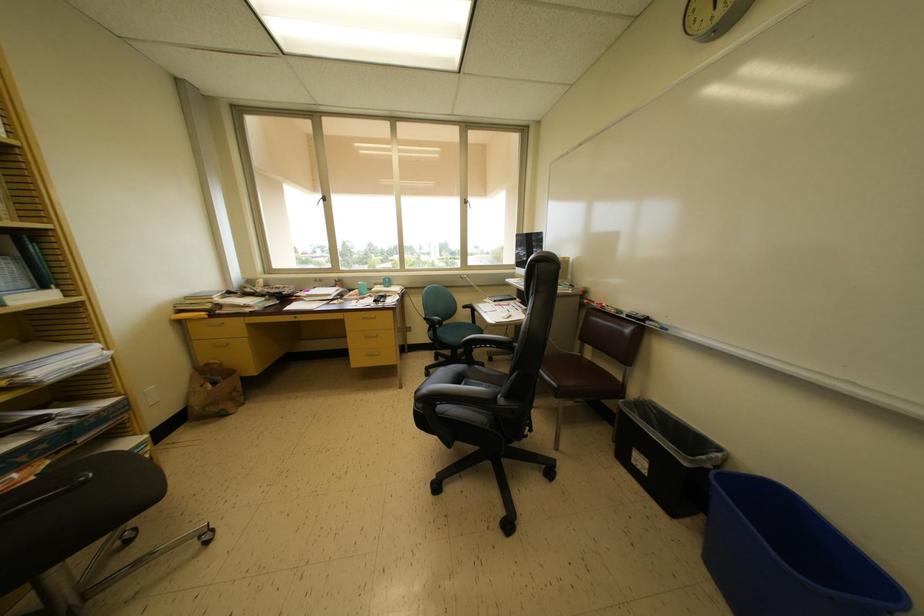
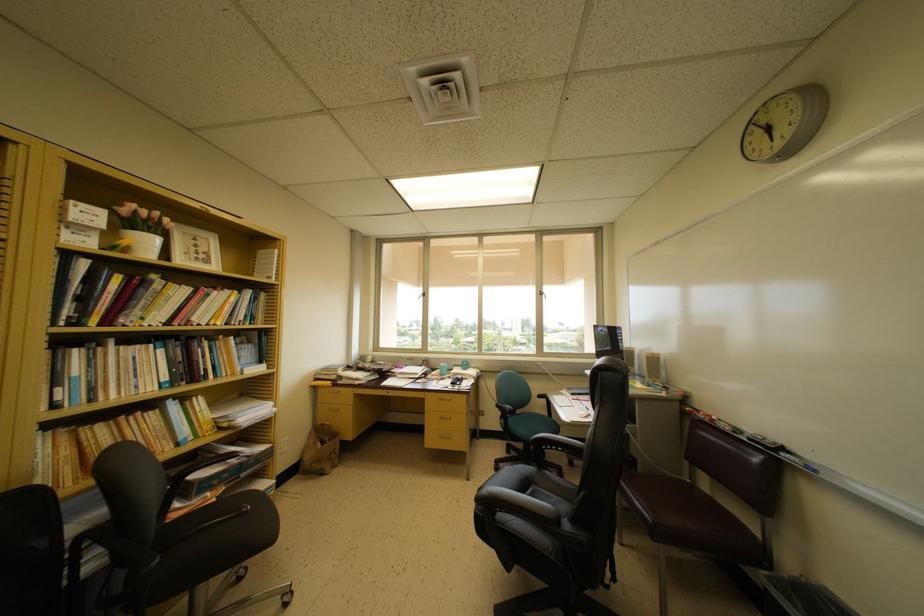
Find the pixel in the second image that matches the point at 468,205 in the first image.

(543, 297)